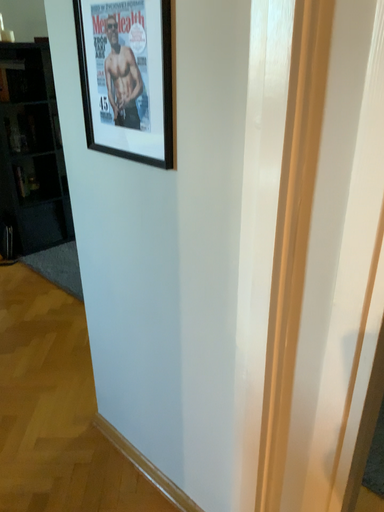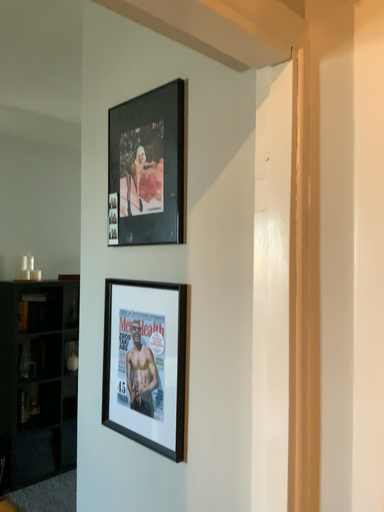
Question: Which way did the camera rotate in the video?

Choices:
 (A) rotated upward
 (B) rotated downward

Answer: (A)